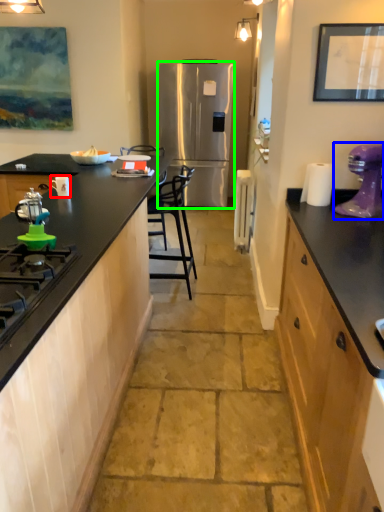
Question: Which is nearer to the appliance (highlighted by a red box)? kitchen appliance (highlighted by a blue box) or refrigerator (highlighted by a green box).

Choices:
 (A) kitchen appliance
 (B) refrigerator

Answer: (A)